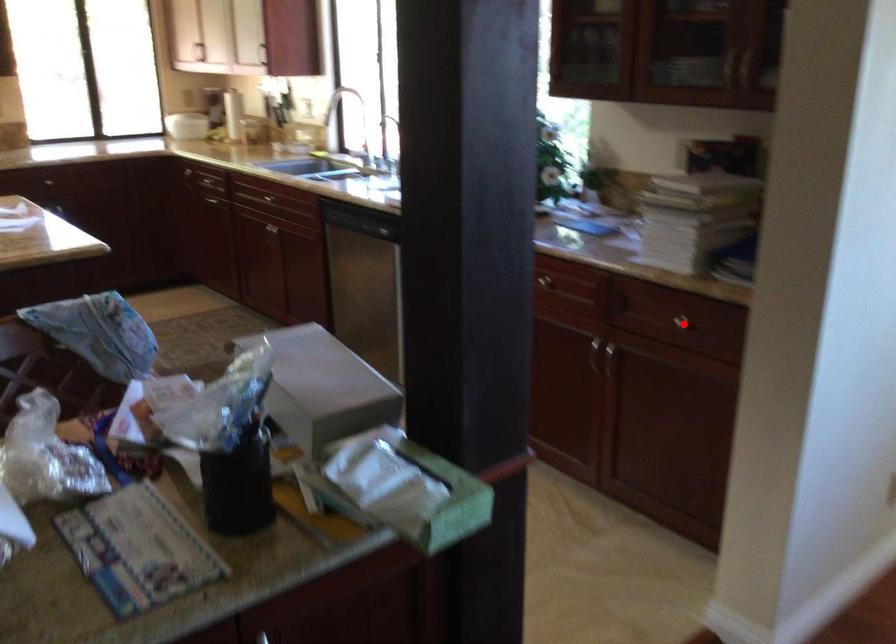
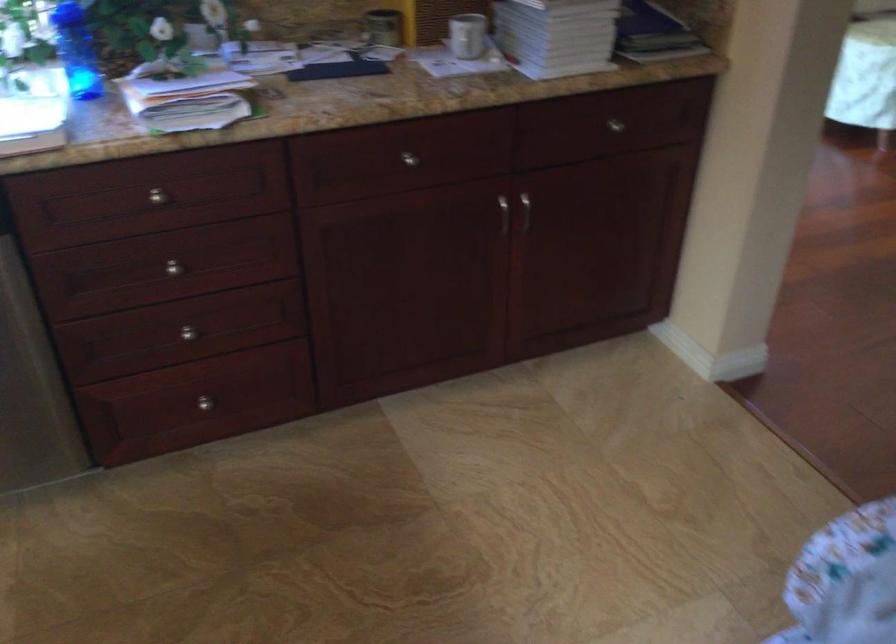
Question: I am providing you with two images of the same scene from different viewpoints. A red point is shown in image1. For the corresponding object point in image2, is it positioned nearer or farther from the camera?

Choices:
 (A) Nearer
 (B) Farther

Answer: (A)